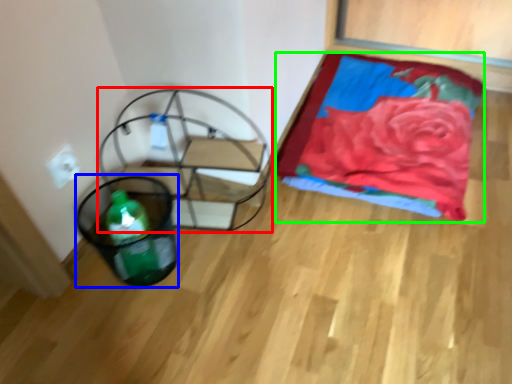
Question: Which object is positioned closest to swivel chair (highlighted by a red box)? Select from basket (highlighted by a blue box) and blanket (highlighted by a green box).

Choices:
 (A) basket
 (B) blanket

Answer: (A)